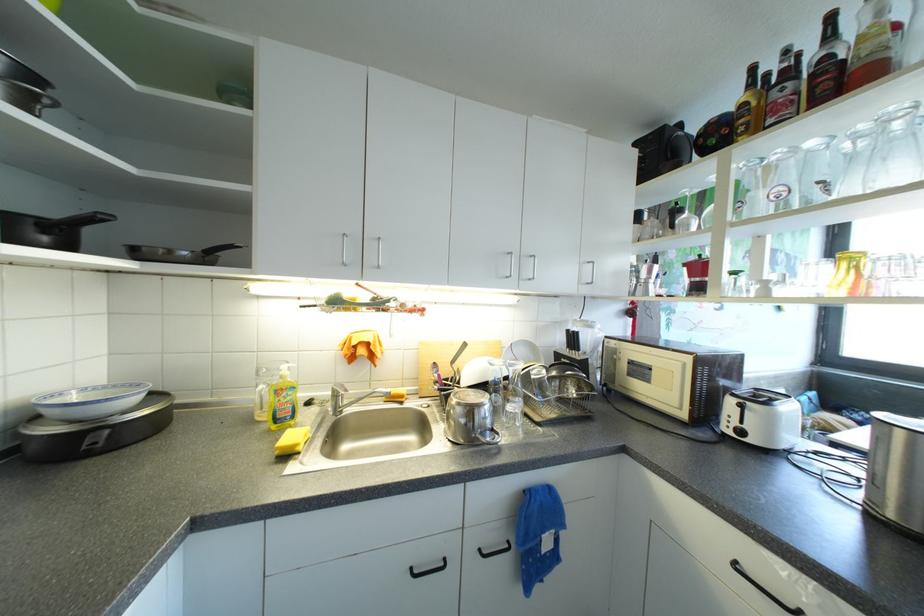
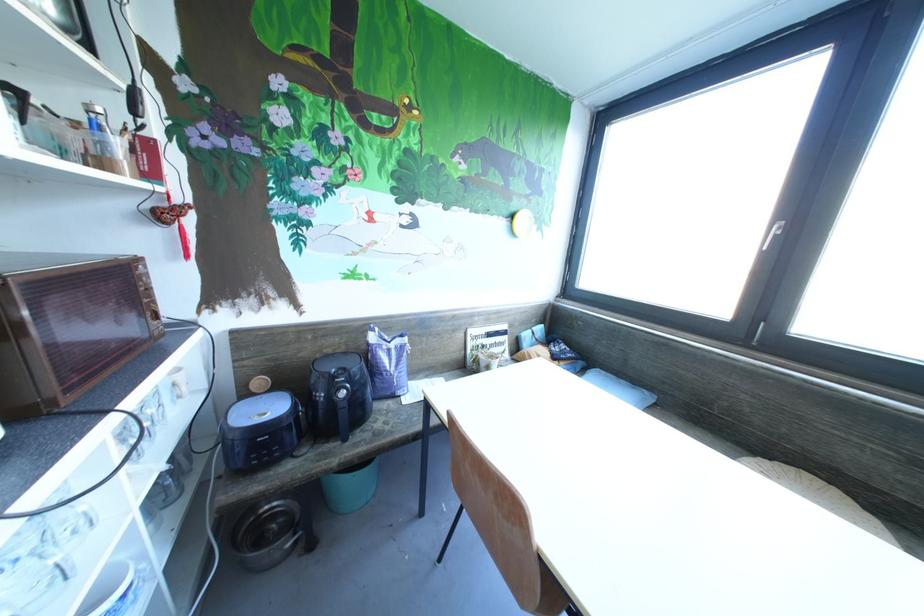
Question: What movement of the cameraman would produce the second image?

Choices:
 (A) Left
 (B) Right
 (C) Forward
 (D) Backward

Answer: (B)